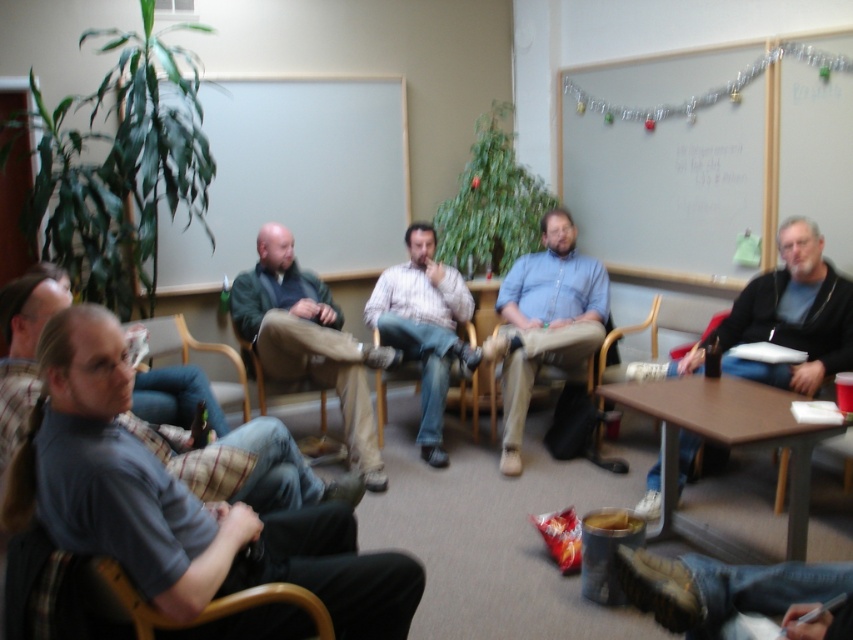
You are organizing a small event and need to seat two guests who have different jacket sizes. The green fabric jacket at center belongs to one guest, and the denim at center belongs to the other. Based on the scene, which guest requires a larger seat?

The guest with the green fabric jacket at center requires a larger seat because the green fabric jacket at center is bigger than the denim at center.

You are standing in the room and want to pick up the green fabric jacket at center without touching the denim at center. Is this possible?

The green fabric jacket at center is above denim at center, so yes, you can pick up the green fabric jacket at center without touching the denim at center by reaching above it.